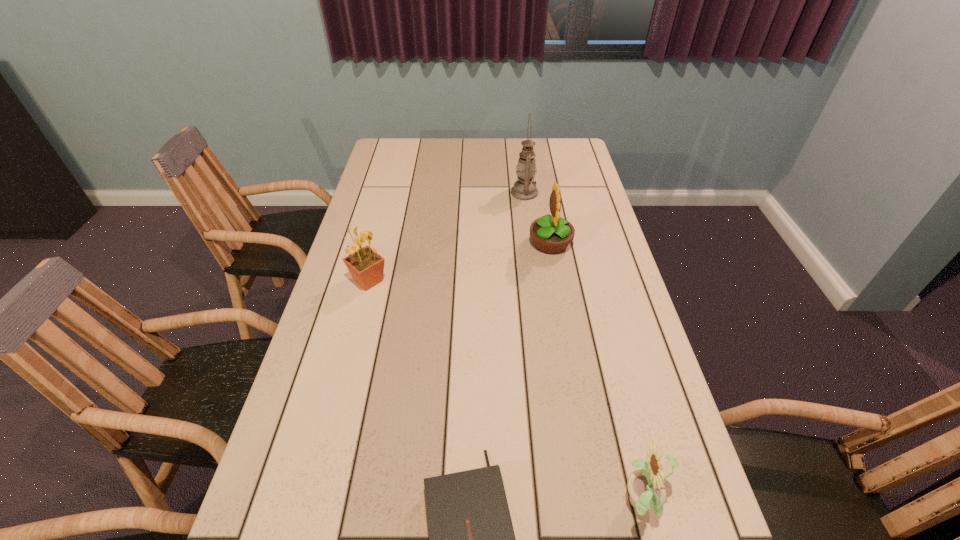
You are a GUI agent. You are given a task and a screenshot of the screen. Output one action in this format:
    pyautogui.click(x=<x>, y=<y>)
    Task: Click on the empty space between the farthest sunflower and the third farthest object
    This screenshot has height=540, width=960.
    Given the screenshot: What is the action you would take?
    pyautogui.click(x=460, y=262)

At what (x,y) coordinates should I click in order to perform the action: click on blank region between the nearest sunflower and the second farthest object. Please return your answer as a coordinate pair (x, y). Looking at the image, I should click on (596, 374).

You are a GUI agent. You are given a task and a screenshot of the screen. Output one action in this format:
    pyautogui.click(x=<x>, y=<y>)
    Task: Click on the vacant area that lies between the farthest sunflower and the third farthest object
    The image size is (960, 540).
    Given the screenshot: What is the action you would take?
    pyautogui.click(x=460, y=262)

Find the location of a particular element. empty space between the second farthest sunflower and the farthest object is located at coordinates (446, 237).

Where is `free space between the nearest sunflower and the fourth nearest object`? The image size is (960, 540). free space between the nearest sunflower and the fourth nearest object is located at coordinates (x=596, y=374).

Identify the location of vacant area that lies between the oil lamp and the second farthest sunflower. Image resolution: width=960 pixels, height=540 pixels. (446, 237).

This screenshot has height=540, width=960. In order to click on object that is the third nearest to the third nearest object in this screenshot , I will do `click(524, 188)`.

Image resolution: width=960 pixels, height=540 pixels. What are the coordinates of `object that can be found as the second closest to the Bible` in the screenshot? It's located at (366, 266).

Where is `sunflower that is the second closest to the third farthest object`? The image size is (960, 540). sunflower that is the second closest to the third farthest object is located at coordinates (647, 492).

Locate an element on the screen. The image size is (960, 540). the third closest sunflower to the Bible is located at coordinates (552, 234).